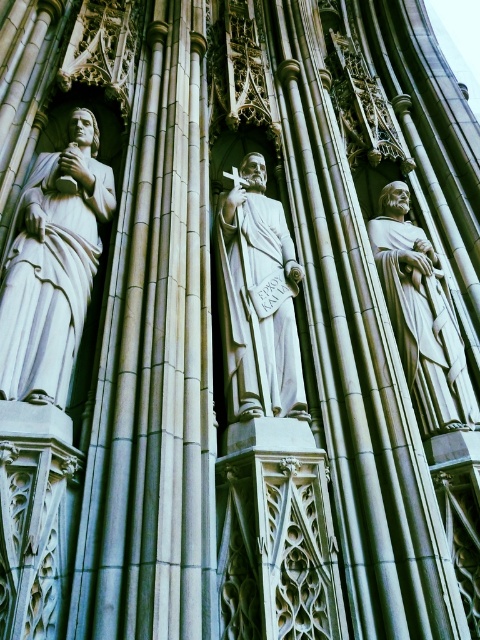
Question: Among these points, which one is farthest from the camera?

Choices:
 (A) (435, 380)
 (B) (79, 148)
 (C) (220, 294)

Answer: (B)

Question: Does white marble statue at center have a smaller size compared to white marble statue at right?

Choices:
 (A) no
 (B) yes

Answer: (B)

Question: Among these objects, which one is farthest from the camera?

Choices:
 (A) white marble statue at center
 (B) white marble statue at right
 (C) white marble statue at left

Answer: (B)

Question: Which of the following is the closest to the observer?

Choices:
 (A) white marble statue at center
 (B) white marble statue at right
 (C) white marble statue at left

Answer: (C)

Question: Where is white marble statue at left located in relation to white marble statue at right in the image?

Choices:
 (A) left
 (B) right

Answer: (A)

Question: Can you confirm if white marble statue at left is bigger than white marble statue at right?

Choices:
 (A) no
 (B) yes

Answer: (B)